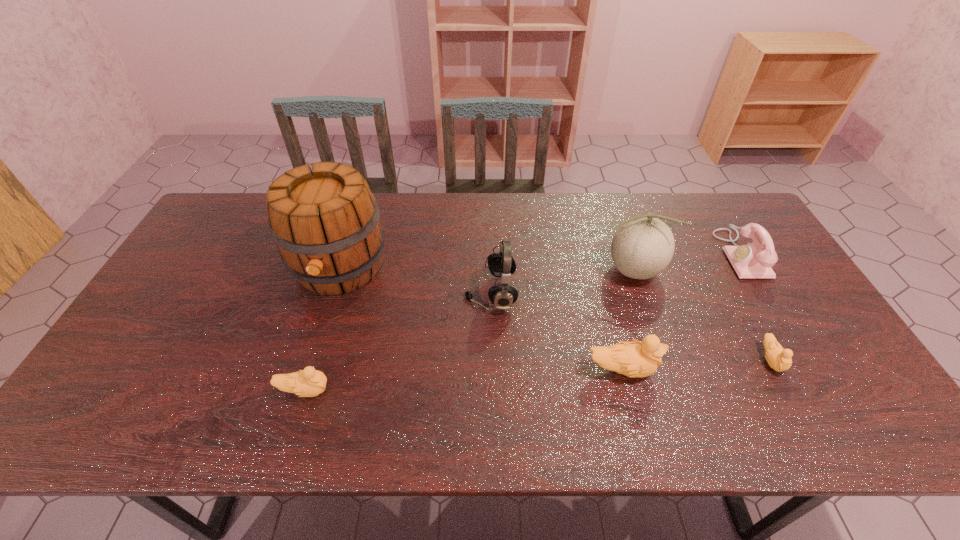
The height and width of the screenshot is (540, 960). In order to click on vacant region located on the face of the second tallest duckling in this screenshot , I will do point(492,390).

Locate an element on the screen. The image size is (960, 540). free location located on the face of the tallest duckling is located at coordinates pyautogui.click(x=779, y=369).

The height and width of the screenshot is (540, 960). I want to click on free space located 0.310m with the microphone on the side of the third object from left to right, so click(x=356, y=293).

Image resolution: width=960 pixels, height=540 pixels. In order to click on vacant space situated 0.130m with the microphone on the side of the third object from left to right in this screenshot , I will do `click(420, 293)`.

Where is `vacant area situated with the microphone on the side of the third object from left to right`? This screenshot has height=540, width=960. vacant area situated with the microphone on the side of the third object from left to right is located at coordinates (416, 293).

I want to click on free spot located on the side of the cider where the spigot is located, so click(312, 356).

You are a GUI agent. You are given a task and a screenshot of the screen. Output one action in this format:
    pyautogui.click(x=<x>, y=<y>)
    Task: Click on the vacant space located on the dial of the rightmost object
    
    Given the screenshot: What is the action you would take?
    pyautogui.click(x=597, y=254)

Where is `blank area located 0.360m on the dial of the rightmost object`? blank area located 0.360m on the dial of the rightmost object is located at coordinates (607, 254).

Where is `free space located on the dial of the rightmost object`? free space located on the dial of the rightmost object is located at coordinates (611, 254).

You are a GUI agent. You are given a task and a screenshot of the screen. Output one action in this format:
    pyautogui.click(x=<x>, y=<y>)
    Task: Click on the blank area located 0.230m on the front of the cantaloup
    The image size is (960, 540).
    Given the screenshot: What is the action you would take?
    point(662,360)